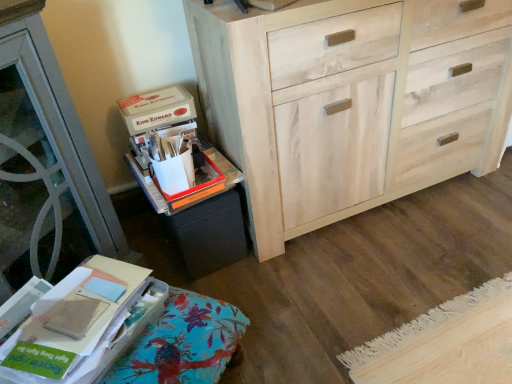
Question: From a real-world perspective, relative to matte cardboard book at lower left, is black matte storage bin at lower left vertically above or below?

Choices:
 (A) below
 (B) above

Answer: (A)

Question: In terms of height, does black matte storage bin at lower left look taller or shorter compared to matte cardboard book at lower left?

Choices:
 (A) tall
 (B) short

Answer: (A)

Question: Estimate the real-world distances between objects in this image. Which object is closer to the natural wood cabinet at center?

Choices:
 (A) black matte storage bin at lower left
 (B) matte cardboard book at lower left
 (C) matte cardboard box at upper left

Answer: (A)

Question: Estimate the real-world distances between objects in this image. Which object is farther from the black matte storage bin at lower left?

Choices:
 (A) matte cardboard book at lower left
 (B) matte cardboard box at upper left
 (C) natural wood cabinet at center

Answer: (C)